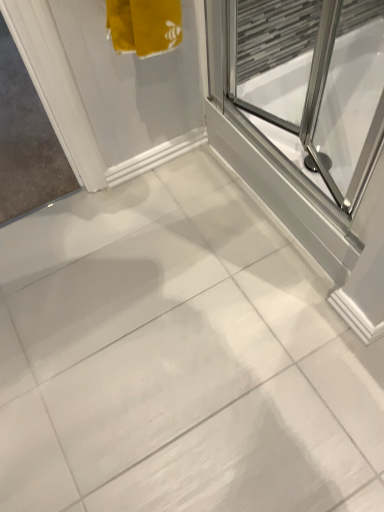
Question: Relative to transparent glass shower door at upper right, is white plastic door at left in front or behind?

Choices:
 (A) front
 (B) behind

Answer: (B)

Question: Choose the correct answer: Is white plastic door at left inside transparent glass shower door at upper right or outside it?

Choices:
 (A) outside
 (B) inside

Answer: (A)

Question: Is white plastic door at left to the left or to the right of transparent glass shower door at upper right in the image?

Choices:
 (A) left
 (B) right

Answer: (A)

Question: Relative to white plastic door at left, is transparent glass shower door at upper right in front or behind?

Choices:
 (A) front
 (B) behind

Answer: (A)

Question: From the image's perspective, relative to white plastic door at left, is transparent glass shower door at upper right above or below?

Choices:
 (A) below
 (B) above

Answer: (A)

Question: Does point (243, 175) appear closer or farther from the camera than point (26, 94)?

Choices:
 (A) closer
 (B) farther

Answer: (A)

Question: In terms of size, does transparent glass shower door at upper right appear bigger or smaller than white plastic door at left?

Choices:
 (A) big
 (B) small

Answer: (A)